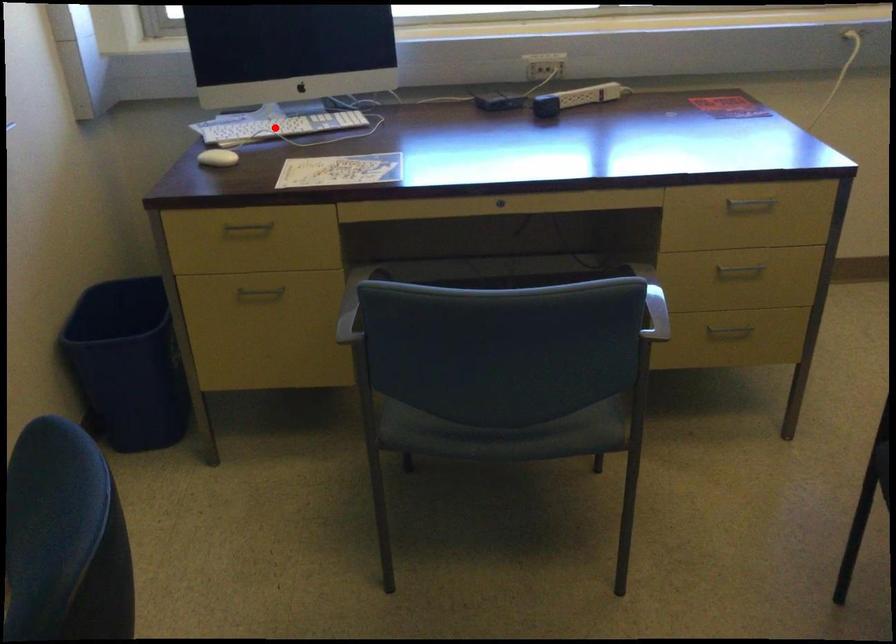
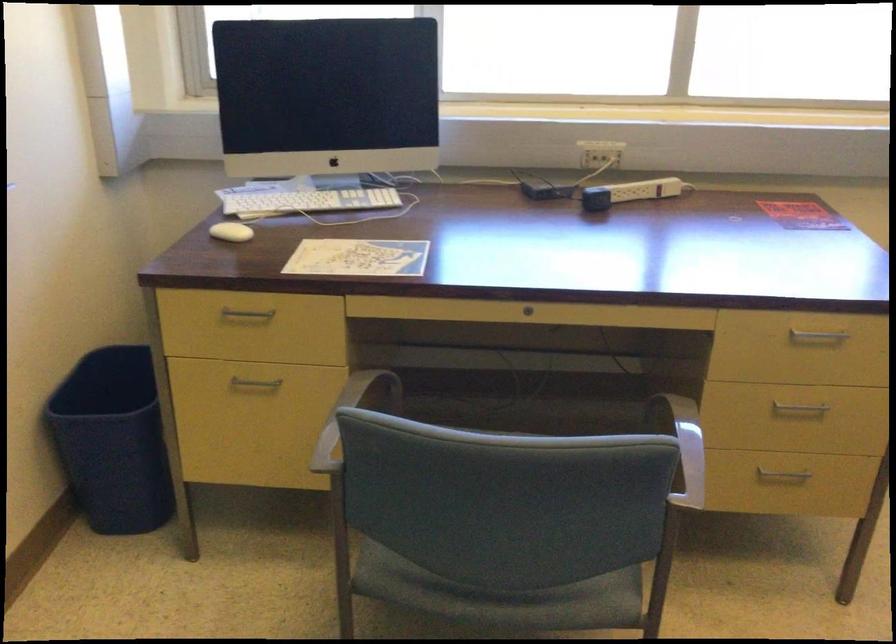
The point at the highlighted location is marked in the first image. Where is the corresponding point in the second image?

(304, 200)